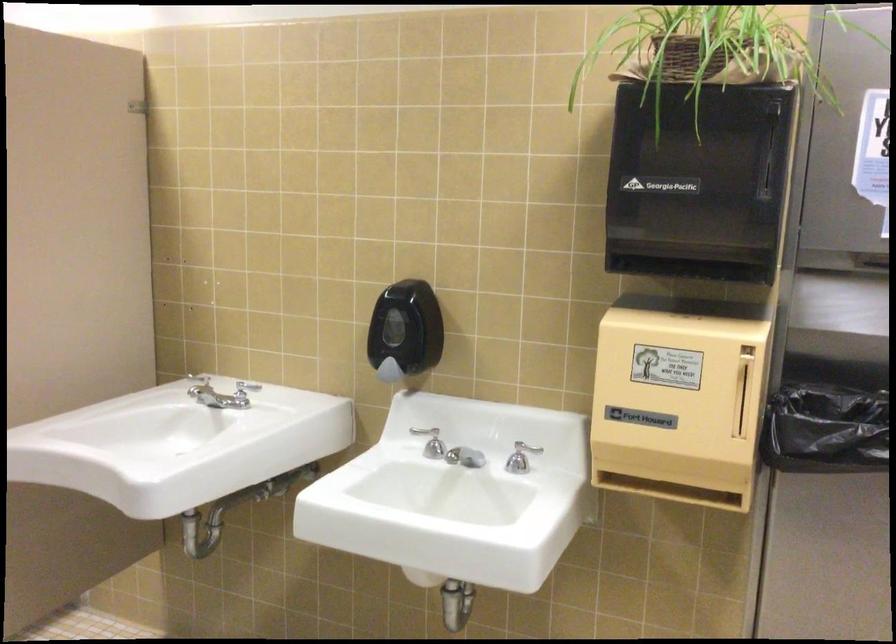
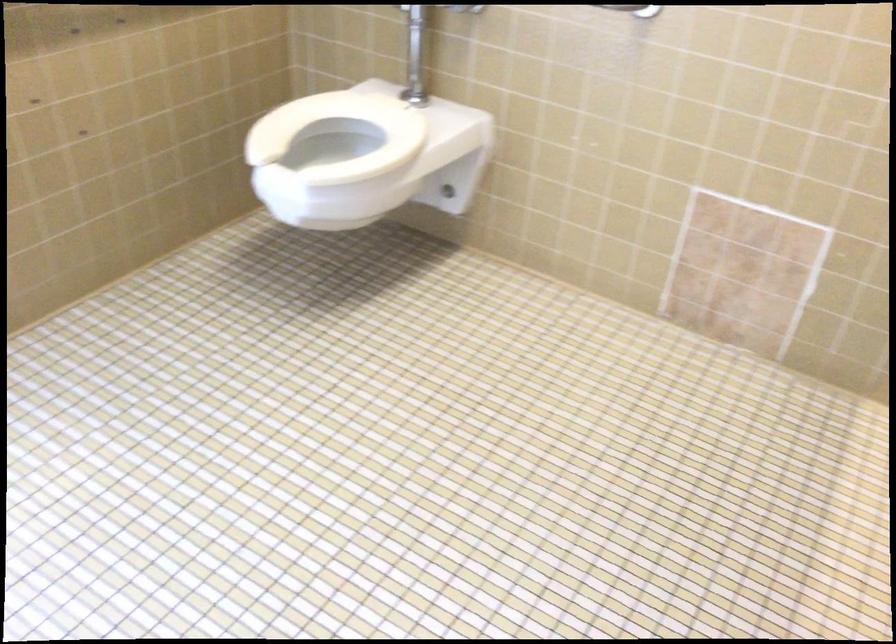
What movement of the cameraman would produce the second image?

The cameraman moved toward left, forward.